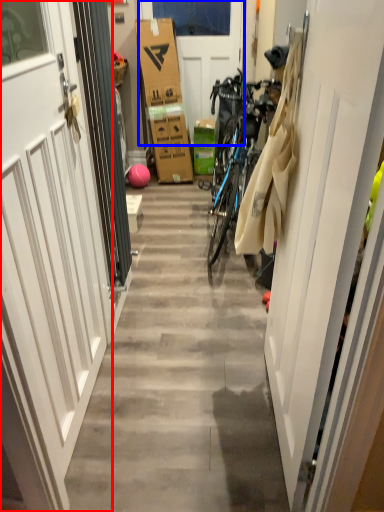
Question: Which of the following is the farthest to the observer, door (highlighted by a red box) or door (highlighted by a blue box)?

Choices:
 (A) door
 (B) door

Answer: (B)